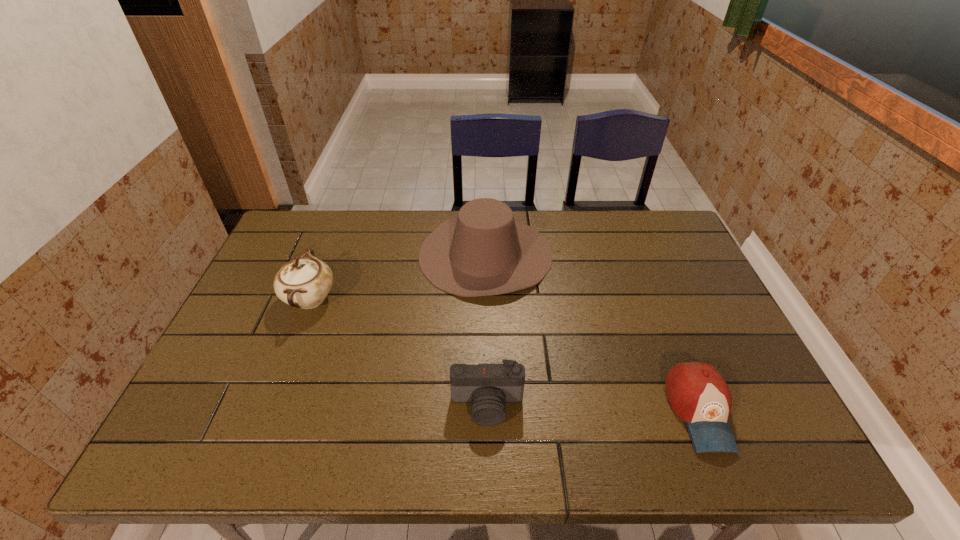
You are a GUI agent. You are given a task and a screenshot of the screen. Output one action in this format:
    pyautogui.click(x=<x>, y=<y>)
    Task: Click on the cowboy hat
    
    Given the screenshot: What is the action you would take?
    pyautogui.click(x=481, y=251)

The image size is (960, 540). Identify the location of the leftmost object. (303, 282).

Locate an element on the screen. This screenshot has width=960, height=540. camera is located at coordinates (488, 387).

You are a GUI agent. You are given a task and a screenshot of the screen. Output one action in this format:
    pyautogui.click(x=<x>, y=<y>)
    Task: Click on the baseball cap
    This screenshot has width=960, height=540.
    Given the screenshot: What is the action you would take?
    pyautogui.click(x=698, y=394)

Image resolution: width=960 pixels, height=540 pixels. Find the location of `the shortest object`. the shortest object is located at coordinates (698, 394).

The image size is (960, 540). I want to click on vacant region located on the right of the cowboy hat, so 674,254.

Find the location of a particular element. The width and height of the screenshot is (960, 540). free space located on the front of the leftmost object is located at coordinates (293, 343).

The width and height of the screenshot is (960, 540). Identify the location of vacant space located 0.060m at the lens of the camera. (488, 453).

Locate an element on the screen. This screenshot has width=960, height=540. object that is at the far edge is located at coordinates (481, 251).

Find the location of a particular element. The height and width of the screenshot is (540, 960). camera located in the near edge section of the desktop is located at coordinates (488, 387).